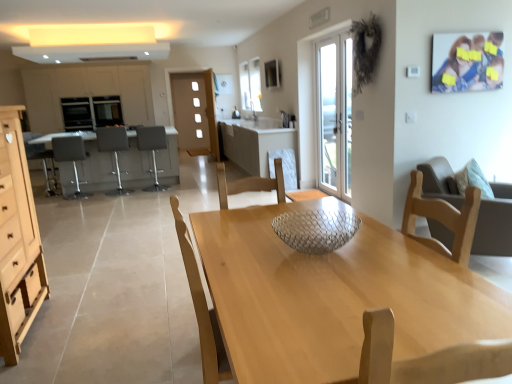
Identify the location of vacant area situated to the left side of clear glass bowl at center. (230, 257).